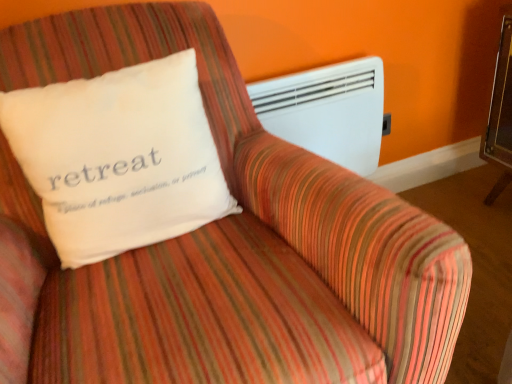
From the picture: In order to face white soft pillow at upper left, should I rotate leftwards or rightwards?

A 16.839 degree turn to the left will do.

What do you see at coordinates (119, 158) in the screenshot? The image size is (512, 384). I see `white soft pillow at upper left` at bounding box center [119, 158].

The height and width of the screenshot is (384, 512). I want to click on white soft pillow at upper left, so click(x=119, y=158).

What is the approximate width of white soft pillow at upper left?

It is 6.35 inches.

This screenshot has width=512, height=384. Find the location of `white plastic heater at upper right`. white plastic heater at upper right is located at coordinates click(x=328, y=111).

What is the approximate height of white plastic heater at upper right?

It is 17.04 inches.

Describe the element at coordinates (328, 111) in the screenshot. This screenshot has height=384, width=512. I see `white plastic heater at upper right` at that location.

The width and height of the screenshot is (512, 384). In order to click on white soft pillow at upper left in this screenshot , I will do `click(119, 158)`.

Based on their positions, is white soft pillow at upper left located to the left or right of white plastic heater at upper right?

From the image, it's evident that white soft pillow at upper left is to the left of white plastic heater at upper right.

Is white soft pillow at upper left positioned behind white plastic heater at upper right?

No, white soft pillow at upper left is closer to the viewer.

Which is in front, point (106, 173) or point (376, 112)?

The point (106, 173) is more forward.

From the image's perspective, which is below, white soft pillow at upper left or white plastic heater at upper right?

white soft pillow at upper left is shown below in the image.

From a real-world perspective, which is physically above, white soft pillow at upper left or white plastic heater at upper right?

white soft pillow at upper left.

Can you confirm if white soft pillow at upper left is thinner than white plastic heater at upper right?

No, white soft pillow at upper left is not thinner than white plastic heater at upper right.

Does white soft pillow at upper left have a lesser height compared to white plastic heater at upper right?

Yes, white soft pillow at upper left is shorter than white plastic heater at upper right.

Which of these two, white soft pillow at upper left or white plastic heater at upper right, is bigger?

white soft pillow at upper left is bigger.

Is white soft pillow at upper left located outside white plastic heater at upper right?

white soft pillow at upper left is positioned outside white plastic heater at upper right.

Is white soft pillow at upper left far away from white plastic heater at upper right?

white soft pillow at upper left is actually quite close to white plastic heater at upper right.

Is white soft pillow at upper left aimed at white plastic heater at upper right?

No, white soft pillow at upper left is not aimed at white plastic heater at upper right.

Identify the location of pillow that is on the left side of white plastic heater at upper right. The image size is (512, 384). (119, 158).

Which is more to the right, white plastic heater at upper right or white soft pillow at upper left?

From the viewer's perspective, white plastic heater at upper right appears more on the right side.

Is the depth of white plastic heater at upper right greater than that of white soft pillow at upper left?

Yes, it is behind white soft pillow at upper left.

Which point is more forward, [367,72] or [37,138]?

The point [37,138] is closer.

From the image's perspective, which is above, white plastic heater at upper right or white soft pillow at upper left?

white plastic heater at upper right, from the image's perspective.

From a real-world perspective, between white plastic heater at upper right and white soft pillow at upper left, who is vertically higher?

white soft pillow at upper left is physically above.

Which of these two, white plastic heater at upper right or white soft pillow at upper left, is thinner?

white plastic heater at upper right.

Which of these two, white plastic heater at upper right or white soft pillow at upper left, stands shorter?

white soft pillow at upper left is shorter.

Is white plastic heater at upper right smaller than white soft pillow at upper left?

Indeed, white plastic heater at upper right has a smaller size compared to white soft pillow at upper left.

Can we say white plastic heater at upper right lies outside white soft pillow at upper left?

Yes, white plastic heater at upper right is not within white soft pillow at upper left.

Is white plastic heater at upper right far from white soft pillow at upper left?

white plastic heater at upper right is actually quite close to white soft pillow at upper left.

Is white plastic heater at upper right oriented away from white soft pillow at upper left?

That's not correct — white plastic heater at upper right is not looking away from white soft pillow at upper left.

Can you tell me how much white plastic heater at upper right and white soft pillow at upper left differ in facing direction?

white plastic heater at upper right and white soft pillow at upper left are facing 4.64 degrees away from each other.

Image resolution: width=512 pixels, height=384 pixels. I want to click on air conditioning that is on the right side of white soft pillow at upper left, so click(328, 111).

I want to click on air conditioning on the right of white soft pillow at upper left, so click(328, 111).

Identify the location of pillow in front of the white plastic heater at upper right. This screenshot has width=512, height=384. (119, 158).